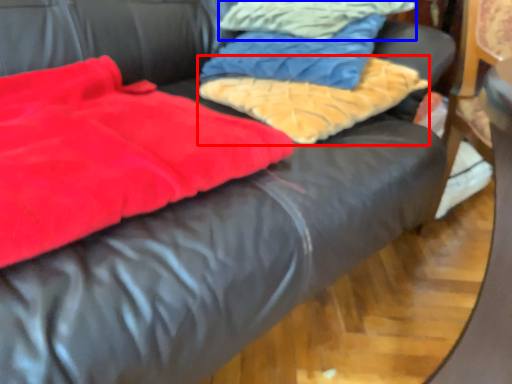
Question: Which object is further to the camera taking this photo, cloth (highlighted by a red box) or cloth (highlighted by a blue box)?

Choices:
 (A) cloth
 (B) cloth

Answer: (B)